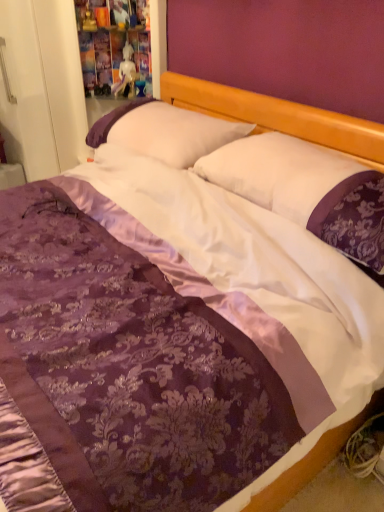
Question: From the image's perspective, is white satin pillow at center, the 1th pillow positioned from the front, over white satin pillow at center, the second pillow viewed from the front?

Choices:
 (A) yes
 (B) no

Answer: (B)

Question: From a real-world perspective, is white satin pillow at center, the second pillow viewed from the back, on white satin pillow at center, the second pillow viewed from the front?

Choices:
 (A) yes
 (B) no

Answer: (A)

Question: Is white satin pillow at center, the second pillow viewed from the back, bigger than white satin pillow at center, the second pillow viewed from the front?

Choices:
 (A) no
 (B) yes

Answer: (A)

Question: Is white satin pillow at center, the second pillow viewed from the front, surrounded by white satin pillow at center, the 1th pillow positioned from the front?

Choices:
 (A) yes
 (B) no

Answer: (B)

Question: Does white satin pillow at center, the 1th pillow positioned from the front, have a greater height compared to white satin pillow at center, the second pillow viewed from the front?

Choices:
 (A) no
 (B) yes

Answer: (A)

Question: Is white satin pillow at center, the 1th pillow positioned from the front, not close to white satin pillow at center, which appears as the first pillow when viewed from the back?

Choices:
 (A) yes
 (B) no

Answer: (B)

Question: Does white satin pillow at center, the second pillow viewed from the front, come in front of white satin pillow at center, the 1th pillow positioned from the front?

Choices:
 (A) no
 (B) yes

Answer: (A)

Question: Can you confirm if white satin pillow at center, which appears as the first pillow when viewed from the back, is smaller than white satin pillow at center, the second pillow viewed from the back?

Choices:
 (A) yes
 (B) no

Answer: (B)

Question: Is white satin pillow at center, which appears as the first pillow when viewed from the back, thinner than white satin pillow at center, the second pillow viewed from the back?

Choices:
 (A) yes
 (B) no

Answer: (B)

Question: Can white satin pillow at center, the second pillow viewed from the back, be found inside white satin pillow at center, which appears as the first pillow when viewed from the back?

Choices:
 (A) yes
 (B) no

Answer: (B)

Question: From a real-world perspective, is white satin pillow at center, which appears as the first pillow when viewed from the back, physically above white satin pillow at center, the second pillow viewed from the back?

Choices:
 (A) no
 (B) yes

Answer: (A)

Question: Is white satin pillow at center, the second pillow viewed from the front, outside white satin pillow at center, the second pillow viewed from the back?

Choices:
 (A) no
 (B) yes

Answer: (B)

Question: Considering the relative sizes of white glossy statue at upper center and white satin pillow at center, the second pillow viewed from the back, in the image provided, is white glossy statue at upper center shorter than white satin pillow at center, the second pillow viewed from the back,?

Choices:
 (A) yes
 (B) no

Answer: (B)